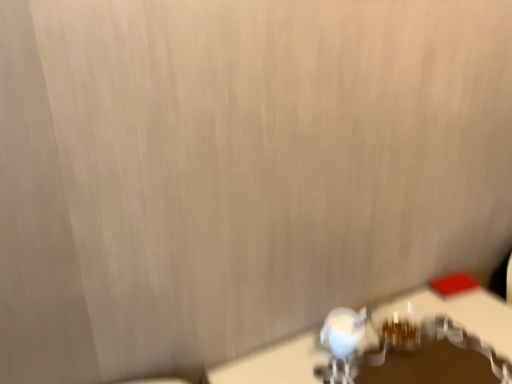
The width and height of the screenshot is (512, 384). What are the coordinates of `white glossy faucet at lower center` in the screenshot? It's located at (348, 346).

What is the approximate width of white glossy faucet at lower center?

It is 4.24 inches.

This screenshot has height=384, width=512. What do you see at coordinates (348, 346) in the screenshot? I see `white glossy faucet at lower center` at bounding box center [348, 346].

What do you see at coordinates (457, 313) in the screenshot? I see `white glossy table at lower right` at bounding box center [457, 313].

Identify the location of white glossy table at lower right. (457, 313).

The width and height of the screenshot is (512, 384). I want to click on white glossy faucet at lower center, so click(348, 346).

Does white glossy faucet at lower center appear on the left side of white glossy table at lower right?

Yes, white glossy faucet at lower center is to the left of white glossy table at lower right.

Does white glossy faucet at lower center lie behind white glossy table at lower right?

Yes, white glossy faucet at lower center is further from the viewer.

Which is in front, point (386, 352) or point (509, 333)?

Point (386, 352)

From the image's perspective, is white glossy faucet at lower center positioned above or below white glossy table at lower right?

Based on their image positions, white glossy faucet at lower center is located above white glossy table at lower right.

From the picture: From a real-world perspective, is white glossy faucet at lower center physically above white glossy table at lower right?

Yes, from a real-world perspective, white glossy faucet at lower center is on top of white glossy table at lower right.

Considering the sizes of objects white glossy faucet at lower center and white glossy table at lower right in the image provided, who is wider, white glossy faucet at lower center or white glossy table at lower right?

white glossy table at lower right is wider.

Is white glossy faucet at lower center shorter than white glossy table at lower right?

Correct, white glossy faucet at lower center is not as tall as white glossy table at lower right.

Does white glossy faucet at lower center have a smaller size compared to white glossy table at lower right?

Indeed, white glossy faucet at lower center has a smaller size compared to white glossy table at lower right.

Based on the photo, is white glossy faucet at lower center located outside white glossy table at lower right?

Yes, white glossy faucet at lower center is located beyond the bounds of white glossy table at lower right.

In the scene shown: Would you say white glossy faucet at lower center is a long distance from white glossy table at lower right?

They are positioned close to each other.

Is white glossy faucet at lower center facing towards white glossy table at lower right?

No, white glossy faucet at lower center is not facing towards white glossy table at lower right.

This screenshot has width=512, height=384. I want to click on faucet above the white glossy table at lower right (from the image's perspective), so pos(348,346).

Considering the positions of objects white glossy table at lower right and white glossy faucet at lower center in the image provided, who is more to the left, white glossy table at lower right or white glossy faucet at lower center?

white glossy faucet at lower center is more to the left.

In the scene shown: Considering the positions of objects white glossy table at lower right and white glossy faucet at lower center in the image provided, who is in front, white glossy table at lower right or white glossy faucet at lower center?

white glossy table at lower right is more forward.

Does point (233, 368) lie behind point (360, 327)?

No, (233, 368) is in front of (360, 327).

From the image's perspective, which is above, white glossy table at lower right or white glossy faucet at lower center?

white glossy faucet at lower center, from the image's perspective.

From a real-world perspective, relative to white glossy faucet at lower center, is white glossy table at lower right vertically above or below?

white glossy table at lower right is below white glossy faucet at lower center.

Can you confirm if white glossy table at lower right is thinner than white glossy faucet at lower center?

No, white glossy table at lower right is not thinner than white glossy faucet at lower center.

Between white glossy table at lower right and white glossy faucet at lower center, which one has less height?

Standing shorter between the two is white glossy faucet at lower center.

Considering the relative sizes of white glossy table at lower right and white glossy faucet at lower center in the image provided, is white glossy table at lower right smaller than white glossy faucet at lower center?

Incorrect, white glossy table at lower right is not smaller in size than white glossy faucet at lower center.

Consider the image. Choose the correct answer: Is white glossy table at lower right inside white glossy faucet at lower center or outside it?

white glossy table at lower right cannot be found inside white glossy faucet at lower center.

Is white glossy table at lower right next to white glossy faucet at lower center?

No, white glossy table at lower right is not in contact with white glossy faucet at lower center.

Is white glossy faucet at lower center at the back of white glossy table at lower right?

No, white glossy faucet at lower center is not at the back of white glossy table at lower right.

How many degrees apart are the facing directions of white glossy table at lower right and white glossy faucet at lower center?

The angular difference between white glossy table at lower right and white glossy faucet at lower center is 2.6e-05 degrees.

How much distance is there between white glossy table at lower right and white glossy faucet at lower center?

A distance of 10.79 centimeters exists between white glossy table at lower right and white glossy faucet at lower center.

Where is `table on the right of white glossy faucet at lower center`? The width and height of the screenshot is (512, 384). table on the right of white glossy faucet at lower center is located at coordinates (457, 313).

At what (x,y) coordinates should I click in order to perform the action: click on faucet above the white glossy table at lower right (from a real-world perspective). Please return your answer as a coordinate pair (x, y). This screenshot has height=384, width=512. Looking at the image, I should click on (348, 346).

I want to click on table in front of the white glossy faucet at lower center, so click(x=457, y=313).